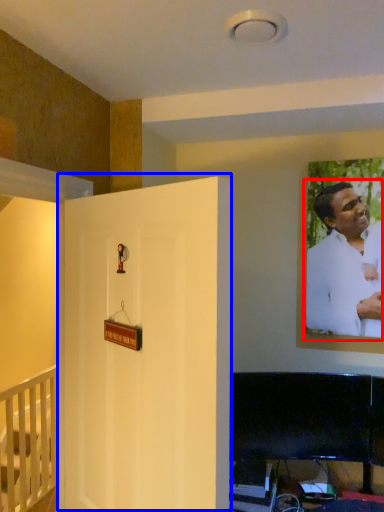
Question: Among these objects, which one is nearest to the camera, man (highlighted by a red box) or door (highlighted by a blue box)?

Choices:
 (A) man
 (B) door

Answer: (B)